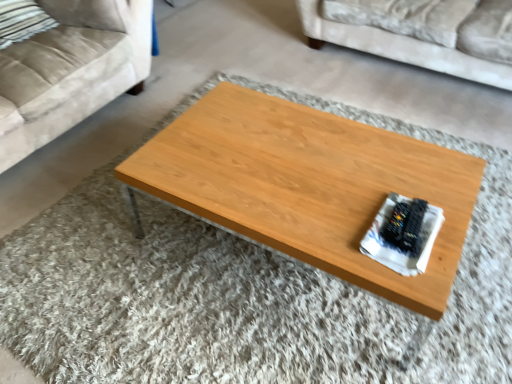
Where is `suede beige couch at upper left, which appears as the 1th studio couch when viewed from the left`? suede beige couch at upper left, which appears as the 1th studio couch when viewed from the left is located at coordinates (70, 70).

The height and width of the screenshot is (384, 512). I want to click on beige fabric pillow at upper left, the first pillow viewed from the right, so [91, 13].

Measure the distance between point (x=12, y=21) and camera.

The depth of point (x=12, y=21) is 7.33 feet.

This screenshot has width=512, height=384. What do you see at coordinates (401, 48) in the screenshot?
I see `velvet beige couch at upper right, which is the first studio couch in right-to-left order` at bounding box center [401, 48].

Find the location of a particular element. suede beige couch at upper left, which appears as the 1th studio couch when viewed from the left is located at coordinates (70, 70).

Which object is closer to the camera, striped fabric pillow at upper left, which ranks as the second pillow in right-to-left order, or velvet beige couch at upper right, the second studio couch when ordered from left to right?

Positioned in front is striped fabric pillow at upper left, which ranks as the second pillow in right-to-left order.

From a real-world perspective, which object stands above the other?

striped fabric pillow at upper left, which ranks as the second pillow in right-to-left order.

Which of these two, striped fabric pillow at upper left, arranged as the 1th pillow when viewed from the left, or velvet beige couch at upper right, the second studio couch when ordered from left to right, is thinner?

Thinner between the two is striped fabric pillow at upper left, arranged as the 1th pillow when viewed from the left.

Is velvet beige couch at upper right, which is the first studio couch in right-to-left order, next to beige fabric pillow at upper left, the first pillow viewed from the right?

velvet beige couch at upper right, which is the first studio couch in right-to-left order, and beige fabric pillow at upper left, the first pillow viewed from the right, are clearly separated.

Does velvet beige couch at upper right, which is the first studio couch in right-to-left order, appear on the right side of beige fabric pillow at upper left, the first pillow viewed from the right?

Indeed, velvet beige couch at upper right, which is the first studio couch in right-to-left order, is positioned on the right side of beige fabric pillow at upper left, the first pillow viewed from the right.

Is velvet beige couch at upper right, which is the first studio couch in right-to-left order, situated inside beige fabric pillow at upper left, the first pillow viewed from the right, or outside?

velvet beige couch at upper right, which is the first studio couch in right-to-left order, is located beyond the bounds of beige fabric pillow at upper left, the first pillow viewed from the right.

From the image's perspective, which object appears higher, velvet beige couch at upper right, which is the first studio couch in right-to-left order, or beige fabric pillow at upper left, the first pillow viewed from the right?

velvet beige couch at upper right, which is the first studio couch in right-to-left order, appears higher in the image.

Which of these two, suede beige couch at upper left, which appears as the 1th studio couch when viewed from the left, or striped fabric pillow at upper left, which ranks as the second pillow in right-to-left order, is smaller?

With smaller size is striped fabric pillow at upper left, which ranks as the second pillow in right-to-left order.

Considering the sizes of objects suede beige couch at upper left, which appears as the 1th studio couch when viewed from the left, and striped fabric pillow at upper left, arranged as the 1th pillow when viewed from the left, in the image provided, who is wider, suede beige couch at upper left, which appears as the 1th studio couch when viewed from the left, or striped fabric pillow at upper left, arranged as the 1th pillow when viewed from the left,?

suede beige couch at upper left, which appears as the 1th studio couch when viewed from the left, is wider.

Is suede beige couch at upper left, which appears as the 2th studio couch when viewed from the right, turned away from striped fabric pillow at upper left, arranged as the 1th pillow when viewed from the left?

Correct, suede beige couch at upper left, which appears as the 2th studio couch when viewed from the right, is looking away from striped fabric pillow at upper left, arranged as the 1th pillow when viewed from the left.

Is woodenmaterial/texturecoffee table at center not near striped fabric pillow at upper left, which ranks as the second pillow in right-to-left order?

Indeed, woodenmaterial/texturecoffee table at center is not near striped fabric pillow at upper left, which ranks as the second pillow in right-to-left order.

From a real-world perspective, is woodenmaterial/texturecoffee table at center positioned under striped fabric pillow at upper left, which ranks as the second pillow in right-to-left order, based on gravity?

Yes, from a real-world perspective, woodenmaterial/texturecoffee table at center is beneath striped fabric pillow at upper left, which ranks as the second pillow in right-to-left order.

Locate an element on the screen. coffee table on the right of striped fabric pillow at upper left, arranged as the 1th pillow when viewed from the left is located at coordinates (308, 185).

Looking at this image, in terms of height, does woodenmaterial/texturecoffee table at center look taller or shorter compared to striped fabric pillow at upper left, which ranks as the second pillow in right-to-left order?

Clearly, woodenmaterial/texturecoffee table at center is taller compared to striped fabric pillow at upper left, which ranks as the second pillow in right-to-left order.

From a real-world perspective, does woodenmaterial/texturecoffee table at center stand above beige fabric pillow at upper left, which is counted as the second pillow, starting from the left?

No, from a real-world perspective, woodenmaterial/texturecoffee table at center is not over beige fabric pillow at upper left, which is counted as the second pillow, starting from the left

Is beige fabric pillow at upper left, which is counted as the second pillow, starting from the left, at the back of woodenmaterial/texturecoffee table at center?

No, woodenmaterial/texturecoffee table at center's orientation is not away from beige fabric pillow at upper left, which is counted as the second pillow, starting from the left.

Is woodenmaterial/texturecoffee table at center spatially inside beige fabric pillow at upper left, the first pillow viewed from the right, or outside of it?

The correct answer is: outside.

Considering the relative sizes of woodenmaterial/texturecoffee table at center and beige fabric pillow at upper left, which is counted as the second pillow, starting from the left, in the image provided, is woodenmaterial/texturecoffee table at center smaller than beige fabric pillow at upper left, which is counted as the second pillow, starting from the left,?

No, woodenmaterial/texturecoffee table at center is not smaller than beige fabric pillow at upper left, which is counted as the second pillow, starting from the left.

From the picture: Which is closer, (106,4) or (39,12)?

Point (106,4) is positioned closer to the camera compared to point (39,12).

Is beige fabric pillow at upper left, the first pillow viewed from the right, wider than striped fabric pillow at upper left, which ranks as the second pillow in right-to-left order?

Indeed, beige fabric pillow at upper left, the first pillow viewed from the right, has a greater width compared to striped fabric pillow at upper left, which ranks as the second pillow in right-to-left order.

Considering the relative sizes of beige fabric pillow at upper left, the first pillow viewed from the right, and striped fabric pillow at upper left, which ranks as the second pillow in right-to-left order, in the image provided, is beige fabric pillow at upper left, the first pillow viewed from the right, bigger than striped fabric pillow at upper left, which ranks as the second pillow in right-to-left order,?

No, beige fabric pillow at upper left, the first pillow viewed from the right, is not bigger than striped fabric pillow at upper left, which ranks as the second pillow in right-to-left order.

What's the angular difference between beige fabric pillow at upper left, the first pillow viewed from the right, and striped fabric pillow at upper left, which ranks as the second pillow in right-to-left order,'s facing directions?

The facing directions of beige fabric pillow at upper left, the first pillow viewed from the right, and striped fabric pillow at upper left, which ranks as the second pillow in right-to-left order, are 5.72 degrees apart.

Is suede beige couch at upper left, which appears as the 2th studio couch when viewed from the right, positioned with its back to woodenmaterial/texturecoffee table at center?

No.

Does suede beige couch at upper left, which appears as the 2th studio couch when viewed from the right, touch woodenmaterial/texturecoffee table at center?

No, suede beige couch at upper left, which appears as the 2th studio couch when viewed from the right, is not in contact with woodenmaterial/texturecoffee table at center.

Considering the sizes of objects suede beige couch at upper left, which appears as the 1th studio couch when viewed from the left, and woodenmaterial/texturecoffee table at center in the image provided, who is shorter, suede beige couch at upper left, which appears as the 1th studio couch when viewed from the left, or woodenmaterial/texturecoffee table at center?

woodenmaterial/texturecoffee table at center is shorter.

From a real-world perspective, is suede beige couch at upper left, which appears as the 1th studio couch when viewed from the left, over woodenmaterial/texturecoffee table at center?

Yes, from a real-world perspective, suede beige couch at upper left, which appears as the 1th studio couch when viewed from the left, is over woodenmaterial/texturecoffee table at center

Locate an element on the screen. This screenshot has width=512, height=384. the 1st pillow positioned above the velvet beige couch at upper right, which is the first studio couch in right-to-left order (from a real-world perspective) is located at coordinates (22, 21).

This screenshot has width=512, height=384. There is a beige fabric pillow at upper left, which is counted as the second pillow, starting from the left. In order to click on the 2nd studio couch below it (from a real-world perspective) in this screenshot , I will do `click(401, 48)`.

Considering their positions, is striped fabric pillow at upper left, which ranks as the second pillow in right-to-left order, positioned closer to woodenmaterial/texturecoffee table at center than beige fabric pillow at upper left, which is counted as the second pillow, starting from the left?

beige fabric pillow at upper left, which is counted as the second pillow, starting from the left, is positioned closer to the anchor woodenmaterial/texturecoffee table at center.

When comparing their distances from woodenmaterial/texturecoffee table at center, does suede beige couch at upper left, which appears as the 2th studio couch when viewed from the right, or velvet beige couch at upper right, which is the first studio couch in right-to-left order, seem closer?

The object closer to woodenmaterial/texturecoffee table at center is suede beige couch at upper left, which appears as the 2th studio couch when viewed from the right.

Estimate the real-world distances between objects in this image. Which object is closer to suede beige couch at upper left, which appears as the 2th studio couch when viewed from the right, beige fabric pillow at upper left, which is counted as the second pillow, starting from the left, or woodenmaterial/texturecoffee table at center?

The object closer to suede beige couch at upper left, which appears as the 2th studio couch when viewed from the right, is beige fabric pillow at upper left, which is counted as the second pillow, starting from the left.

From the image, which object appears to be farther from woodenmaterial/texturecoffee table at center, striped fabric pillow at upper left, arranged as the 1th pillow when viewed from the left, or velvet beige couch at upper right, which is the first studio couch in right-to-left order?

Among the two, striped fabric pillow at upper left, arranged as the 1th pillow when viewed from the left, is located further to woodenmaterial/texturecoffee table at center.

From the picture: Estimate the real-world distances between objects in this image. Which object is closer to woodenmaterial/texturecoffee table at center, suede beige couch at upper left, which appears as the 1th studio couch when viewed from the left, or beige fabric pillow at upper left, the first pillow viewed from the right?

suede beige couch at upper left, which appears as the 1th studio couch when viewed from the left, is positioned closer to the anchor woodenmaterial/texturecoffee table at center.

Looking at the image, which one is located closer to suede beige couch at upper left, which appears as the 1th studio couch when viewed from the left, striped fabric pillow at upper left, which ranks as the second pillow in right-to-left order, or beige fabric pillow at upper left, the first pillow viewed from the right?

Based on the image, beige fabric pillow at upper left, the first pillow viewed from the right, appears to be nearer to suede beige couch at upper left, which appears as the 1th studio couch when viewed from the left.

Looking at the image, which one is located further to suede beige couch at upper left, which appears as the 2th studio couch when viewed from the right, beige fabric pillow at upper left, the first pillow viewed from the right, or striped fabric pillow at upper left, which ranks as the second pillow in right-to-left order?

striped fabric pillow at upper left, which ranks as the second pillow in right-to-left order, lies further to suede beige couch at upper left, which appears as the 2th studio couch when viewed from the right, than the other object.

Based on their spatial positions, is velvet beige couch at upper right, which is the first studio couch in right-to-left order, or suede beige couch at upper left, which appears as the 1th studio couch when viewed from the left, further from beige fabric pillow at upper left, the first pillow viewed from the right?

velvet beige couch at upper right, which is the first studio couch in right-to-left order, is further to beige fabric pillow at upper left, the first pillow viewed from the right.

You are a GUI agent. You are given a task and a screenshot of the screen. Output one action in this format:
    pyautogui.click(x=<x>, y=<y>)
    Task: Click on the coffee table situated between beige fabric pillow at upper left, the first pillow viewed from the right, and velvet beige couch at upper right, the second studio couch when ordered from left to right, from left to right
    
    Given the screenshot: What is the action you would take?
    pos(308,185)

At what (x,y) coordinates should I click in order to perform the action: click on studio couch located between striped fabric pillow at upper left, which ranks as the second pillow in right-to-left order, and woodenmaterial/texturecoffee table at center in the left-right direction. Please return your answer as a coordinate pair (x, y). The height and width of the screenshot is (384, 512). Looking at the image, I should click on (70, 70).

Find the location of a particular element. Image resolution: width=512 pixels, height=384 pixels. pillow located between suede beige couch at upper left, which appears as the 2th studio couch when viewed from the right, and velvet beige couch at upper right, which is the first studio couch in right-to-left order, in the left-right direction is located at coordinates (91, 13).

The height and width of the screenshot is (384, 512). Find the location of `pillow between suede beige couch at upper left, which appears as the 1th studio couch when viewed from the left, and beige fabric pillow at upper left, which is counted as the second pillow, starting from the left, along the z-axis`. pillow between suede beige couch at upper left, which appears as the 1th studio couch when viewed from the left, and beige fabric pillow at upper left, which is counted as the second pillow, starting from the left, along the z-axis is located at coordinates (22, 21).